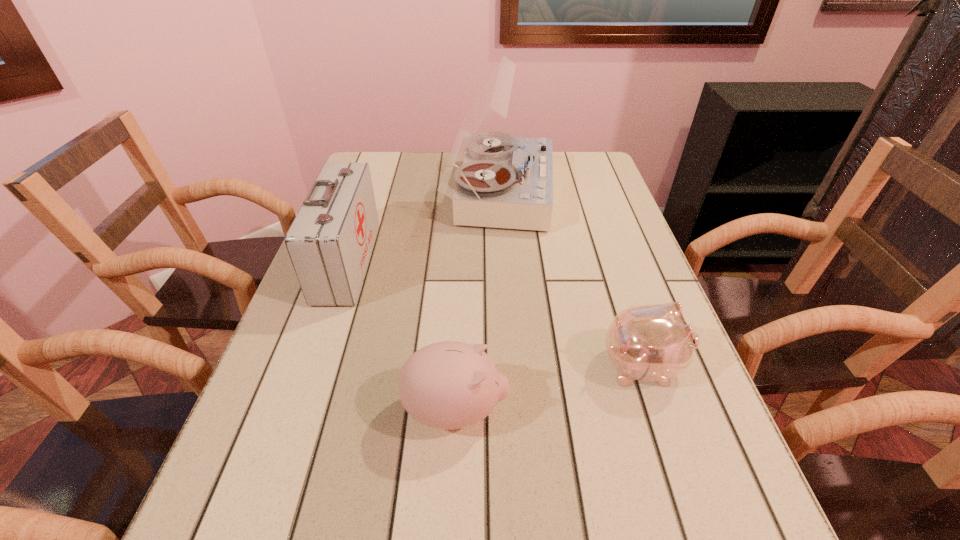
Locate an element on the screen. record player is located at coordinates (505, 182).

Find the location of a particular element. the leftmost object is located at coordinates (330, 241).

Where is `the second tallest object`? The width and height of the screenshot is (960, 540). the second tallest object is located at coordinates (330, 241).

This screenshot has width=960, height=540. What are the coordinates of `the left piggy bank` in the screenshot? It's located at (447, 385).

Where is `the rightmost object`? The width and height of the screenshot is (960, 540). the rightmost object is located at coordinates (653, 343).

The width and height of the screenshot is (960, 540). I want to click on free space located 0.070m on the front-facing side of the third shortest object, so click(397, 262).

At what (x,y) coordinates should I click in order to perform the action: click on free space located at the snout of the left piggy bank. Please return your answer as a coordinate pair (x, y). The width and height of the screenshot is (960, 540). Looking at the image, I should click on (621, 410).

Identify the location of object that is positioned at the far edge. (505, 182).

Where is `object at the left edge`? object at the left edge is located at coordinates (330, 241).

The width and height of the screenshot is (960, 540). I want to click on object at the right edge, so click(x=653, y=343).